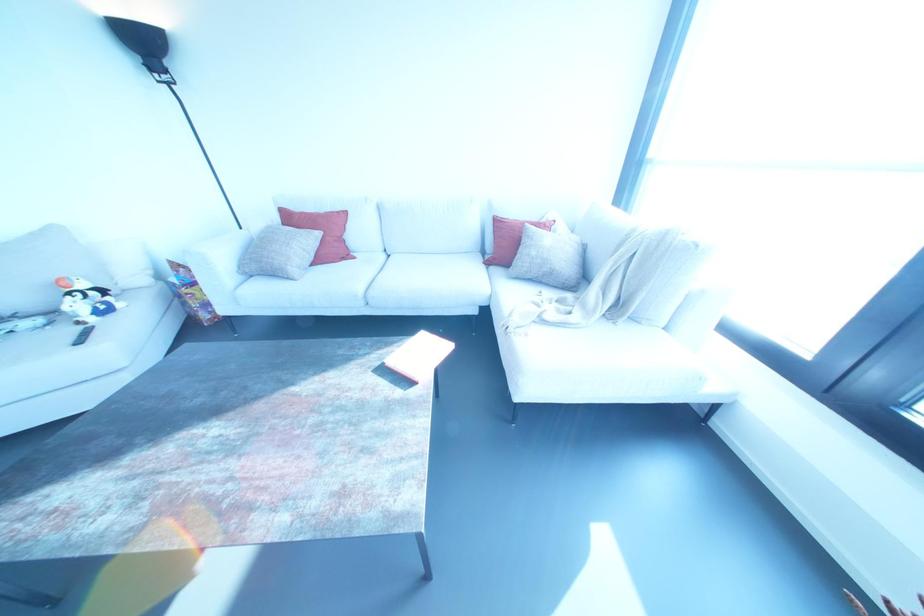
Where is `penguin stuffed toy`? The width and height of the screenshot is (924, 616). penguin stuffed toy is located at coordinates (86, 300).